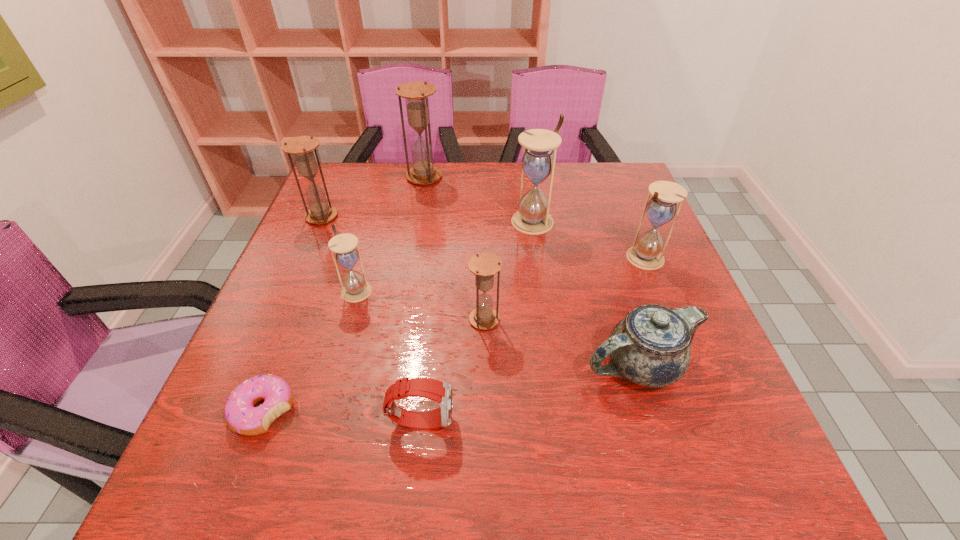
Select which brown hourglass is the second closest to the farthest object. Please provide its 2D coordinates. Your answer should be formatted as a tuple, i.e. [(x, y)], where the tuple contains the x and y coordinates of a point satisfying the conditions above.

[(484, 265)]

Point out which brown hourglass is positioned as the second nearest to the red watch. Please provide its 2D coordinates. Your answer should be formatted as a tuple, i.e. [(x, y)], where the tuple contains the x and y coordinates of a point satisfying the conditions above.

[(301, 147)]

I want to click on the second closest white hourglass to the second nearest white hourglass, so click(x=356, y=288).

Identify which white hourglass is the third nearest to the fourth object from right to left. Please provide its 2D coordinates. Your answer should be formatted as a tuple, i.e. [(x, y)], where the tuple contains the x and y coordinates of a point satisfying the conditions above.

[(645, 253)]

Locate an element on the screen. vacant space that satisfies the following two spatial constraints: 1. on the front side of the farthest white hourglass; 2. on the right side of the second farthest brown hourglass is located at coordinates (320, 221).

Where is `vacant region that satisfies the following two spatial constraints: 1. on the front side of the nearest brown hourglass; 2. on the face of the red watch`? This screenshot has width=960, height=540. vacant region that satisfies the following two spatial constraints: 1. on the front side of the nearest brown hourglass; 2. on the face of the red watch is located at coordinates (485, 420).

This screenshot has height=540, width=960. Identify the location of free location that satisfies the following two spatial constraints: 1. on the front side of the sixth object from left to right; 2. on the right side of the leftmost white hourglass. (348, 319).

Locate an element on the screen. free spot that satisfies the following two spatial constraints: 1. on the front side of the farthest white hourglass; 2. on the face of the red watch is located at coordinates (561, 420).